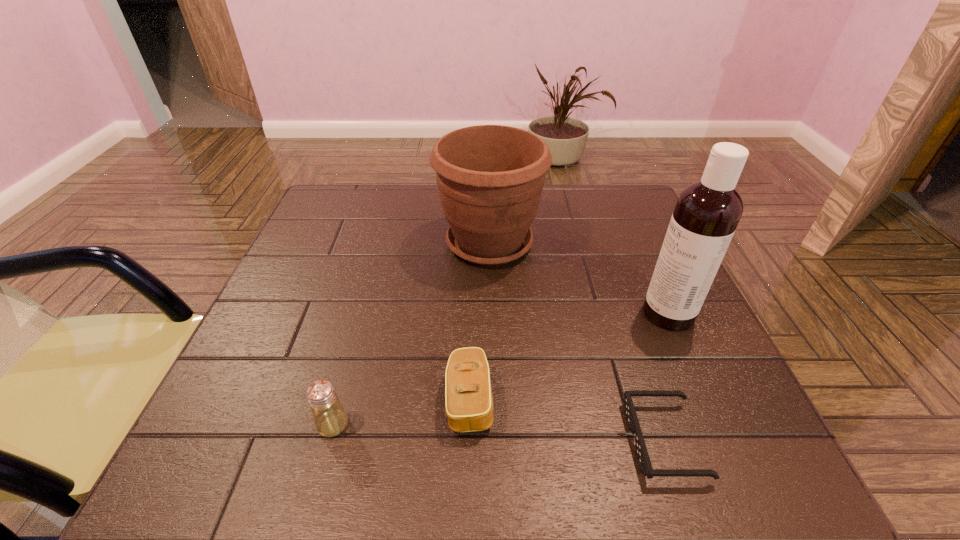
Find the location of a particular element. This screenshot has width=960, height=540. vacant area between the clutch bag and the leftmost object is located at coordinates (401, 412).

This screenshot has height=540, width=960. I want to click on object that is the third closest to the shortest object, so click(490, 178).

Select which object is the third closest to the leftmost object. Please provide its 2D coordinates. Your answer should be formatted as a tuple, i.e. [(x, y)], where the tuple contains the x and y coordinates of a point satisfying the conditions above.

[(641, 452)]

Locate an element on the screen. The width and height of the screenshot is (960, 540). free region that satisfies the following two spatial constraints: 1. on the back side of the fourth shortest object; 2. on the right side of the saltshaker is located at coordinates (383, 243).

Find the location of a particular element. vacant space that satisfies the following two spatial constraints: 1. on the zipper side of the clutch bag; 2. on the front side of the saltshaker is located at coordinates (469, 424).

This screenshot has height=540, width=960. I want to click on vacant space that satisfies the following two spatial constraints: 1. on the label side of the fourth nearest object; 2. on the front side of the third tallest object, so click(718, 424).